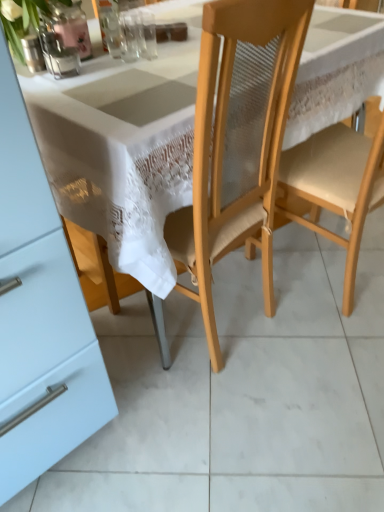
Question: Is light wood chair at center, the 2th chair in the left-to-right sequence, taller or shorter than clear glass vase at upper center, the 2th tableware when ordered from left to right?

Choices:
 (A) tall
 (B) short

Answer: (A)

Question: From a real-world perspective, is light wood chair at center, the 1th chair when ordered from right to left, above or below clear glass vase at upper center, the second tableware from the right?

Choices:
 (A) below
 (B) above

Answer: (A)

Question: Estimate the real-world distances between objects in this image. Which object is closer to the matte glass vase at upper left, the third tableware viewed from the right?

Choices:
 (A) light wood chair at center, the 1th chair when ordered from right to left
 (B) transparent glass at upper center, arranged as the first tableware when viewed from the right
 (C) clear glass vase at upper center, the 2th tableware when ordered from left to right
 (D) wooden chair at center, which ranks as the 2th chair in right-to-left order

Answer: (C)

Question: Which is farther from the light wood chair at center, the 1th chair when ordered from right to left?

Choices:
 (A) transparent glass at upper center, arranged as the first tableware when viewed from the right
 (B) matte glass vase at upper left, which is counted as the first tableware, starting from the left
 (C) wooden chair at center, the first chair positioned from the left
 (D) clear glass vase at upper center, the second tableware from the right

Answer: (B)